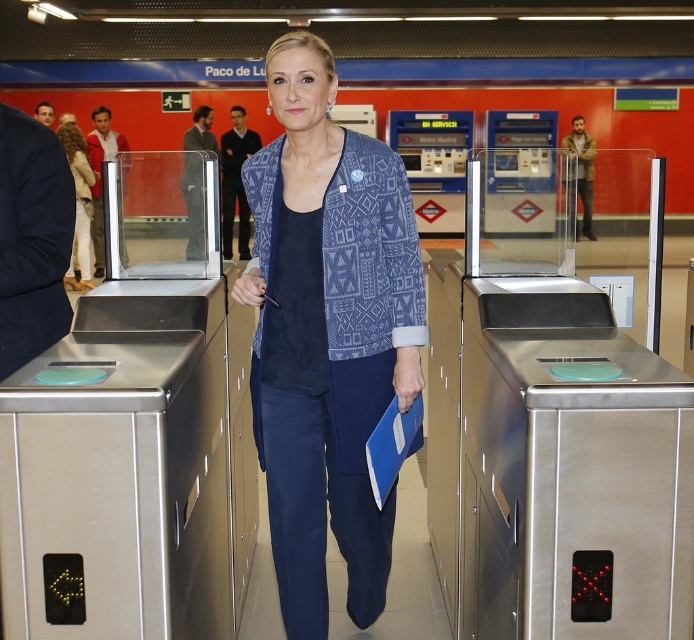
You are a passenger at Paco de Lucia station and want to reach the platform. You see two points marked in the image. The first point is at coordinates point (312, 356) and the second point is at coordinates point (78, 202). Which point is closer to the platform entrance?

Point (312, 356) is in front of point (78, 202), so it is closer to the platform entrance.

Please describe the object located at the coordinates point (328, 333) in the image of the subway station.

The object at point (328, 333) is the blue printed blazer at center.

You are an observer at the metro station. You notice two jackets in the scene. The blue printed blazer at center and the light brown leather jacket at upper left. Which jacket is positioned lower in the image?

The blue printed blazer at center is positioned lower than the light brown leather jacket at upper left.